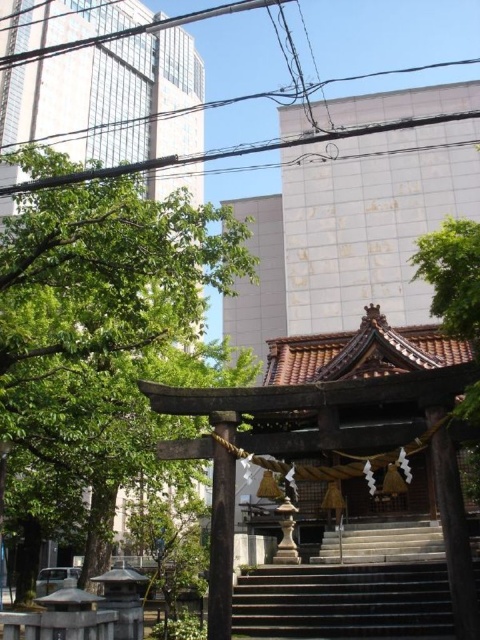
You are standing in front of the shrine and want to take a photo of the green leafy tree at left. If your camera has a maximum focus range of 10 meters, will you be able to capture the tree clearly?

The green leafy tree at left is 10.74 meters away from the camera. Since the maximum focus range is 10 meters, the camera cannot focus on the tree clearly at that distance.

You are a visitor to the shrine and want to take a photo that includes both the green leafy tree at left and the stone stairs at center. Which object should you position closer to the edge of your camera frame to ensure both are fully visible?

Since the green leafy tree at left is bigger than the stone stairs at center, you should position the green leafy tree at left closer to the edge of your camera frame to ensure both are fully visible.